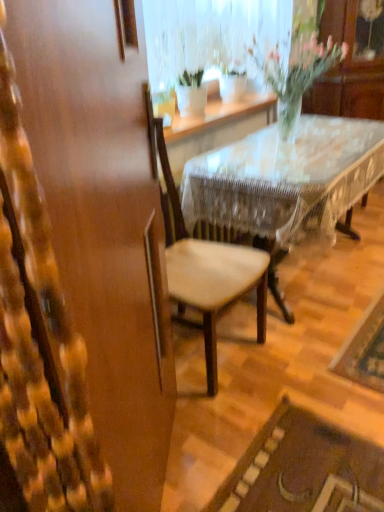
Question: Considering the relative sizes of translucent glass vase at upper center and wooden chair at center in the image provided, is translucent glass vase at upper center wider than wooden chair at center?

Choices:
 (A) no
 (B) yes

Answer: (A)

Question: Does translucent glass vase at upper center have a lesser height compared to wooden chair at center?

Choices:
 (A) yes
 (B) no

Answer: (A)

Question: Is translucent glass vase at upper center outside wooden chair at center?

Choices:
 (A) yes
 (B) no

Answer: (A)

Question: Can wooden chair at center be found inside translucent glass vase at upper center?

Choices:
 (A) yes
 (B) no

Answer: (B)

Question: Considering the relative sizes of translucent glass vase at upper center and wooden chair at center in the image provided, is translucent glass vase at upper center thinner than wooden chair at center?

Choices:
 (A) no
 (B) yes

Answer: (B)

Question: From their relative heights in the image, would you say translucent glass vase at upper center is taller or shorter than wooden chair at center?

Choices:
 (A) short
 (B) tall

Answer: (A)

Question: Considering their positions, is translucent glass vase at upper center located in front of or behind wooden chair at center?

Choices:
 (A) behind
 (B) front

Answer: (A)

Question: Considering the positions of translucent glass vase at upper center and wooden chair at center in the image, is translucent glass vase at upper center wider or thinner than wooden chair at center?

Choices:
 (A) thin
 (B) wide

Answer: (A)

Question: Considering the positions of translucent glass vase at upper center and wooden chair at center in the image, is translucent glass vase at upper center bigger or smaller than wooden chair at center?

Choices:
 (A) small
 (B) big

Answer: (A)

Question: From their relative heights in the image, would you say wooden lace-covered table at center is taller or shorter than wooden chair at center?

Choices:
 (A) short
 (B) tall

Answer: (A)

Question: From the image's perspective, is wooden lace-covered table at center positioned above or below wooden chair at center?

Choices:
 (A) below
 (B) above

Answer: (B)

Question: Does point (188, 170) appear closer or farther from the camera than point (259, 283)?

Choices:
 (A) closer
 (B) farther

Answer: (B)

Question: Considering their positions, is wooden lace-covered table at center located in front of or behind wooden chair at center?

Choices:
 (A) front
 (B) behind

Answer: (B)

Question: In terms of width, does wooden lace-covered table at center look wider or thinner when compared to translucent glass vase at upper center?

Choices:
 (A) thin
 (B) wide

Answer: (B)

Question: From the image's perspective, is wooden lace-covered table at center above or below translucent glass vase at upper center?

Choices:
 (A) below
 (B) above

Answer: (A)